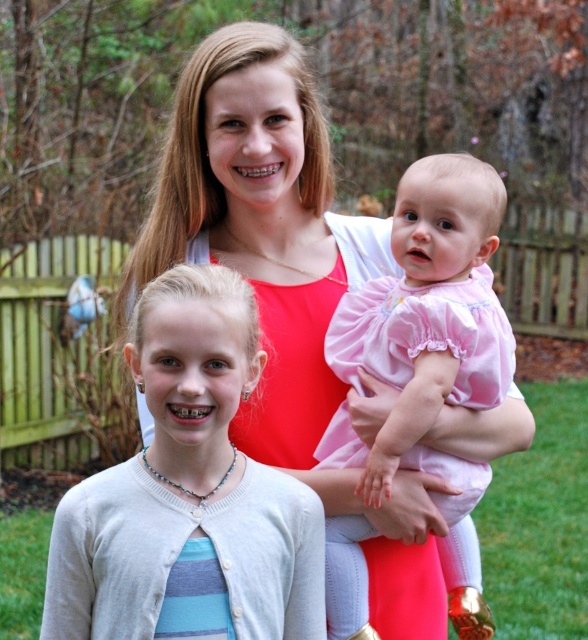
Question: Which object is positioned closest to the white knit cardigan at center?

Choices:
 (A) pink satin dress at center
 (B) matte red tank top at center

Answer: (A)

Question: Does matte red tank top at center come in front of white knit cardigan at center?

Choices:
 (A) no
 (B) yes

Answer: (A)

Question: Where is white knit cardigan at center located in relation to pink satin dress at center in the image?

Choices:
 (A) right
 (B) left

Answer: (B)

Question: Which object is farther from the camera taking this photo?

Choices:
 (A) matte red tank top at center
 (B) pink satin dress at center

Answer: (A)

Question: Can you confirm if matte red tank top at center is positioned below pink satin dress at center?

Choices:
 (A) yes
 (B) no

Answer: (B)

Question: Which of these objects is positioned closest to the matte red tank top at center?

Choices:
 (A) white knit cardigan at center
 (B) pink satin dress at center

Answer: (B)